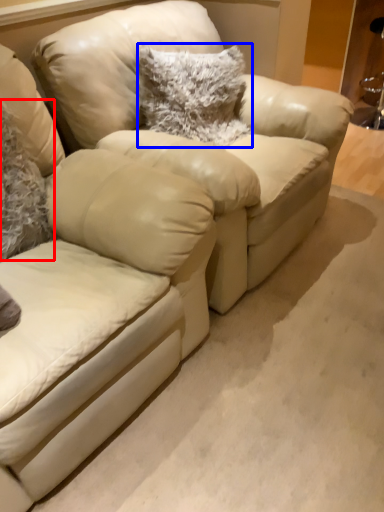
Question: Which of the following is the farthest to the observer, pillow (highlighted by a red box) or pillow (highlighted by a blue box)?

Choices:
 (A) pillow
 (B) pillow

Answer: (B)